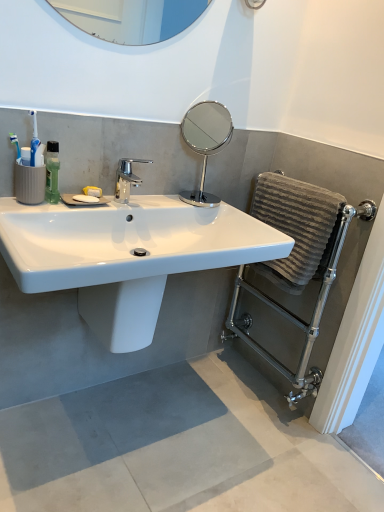
The image size is (384, 512). Identify the location of free point below white glossy sink at center (from a real-world perspective). click(123, 424).